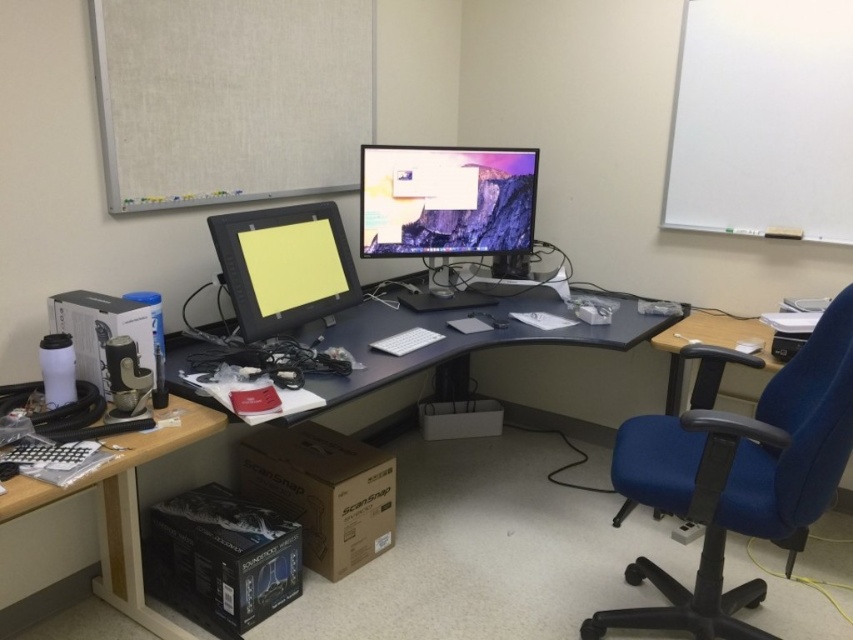
Question: Considering the real-world distances, which object is farthest from the black plastic keyboard at lower left?

Choices:
 (A) blue fabric swivel chair at right
 (B) matte black monitor at center
 (C) satin black monitor at center
 (D) matte black computer desk at center

Answer: (A)

Question: Where is satin black monitor at center located in relation to black plastic keyboard at lower left in the image?

Choices:
 (A) above
 (B) below

Answer: (A)

Question: Which of these objects is positioned closest to the matte black monitor at center?

Choices:
 (A) blue fabric swivel chair at right
 (B) black plastic keyboard at lower left
 (C) matte black computer desk at center

Answer: (C)

Question: Is satin black monitor at center in front of black plastic keyboard at lower left?

Choices:
 (A) no
 (B) yes

Answer: (A)

Question: Which object is the farthest from the matte black computer desk at center?

Choices:
 (A) blue fabric swivel chair at right
 (B) black plastic keyboard at lower left
 (C) matte black monitor at center
 (D) satin black monitor at center

Answer: (B)

Question: Where is matte black computer desk at center located in relation to black plastic keyboard at lower left in the image?

Choices:
 (A) below
 (B) above

Answer: (B)